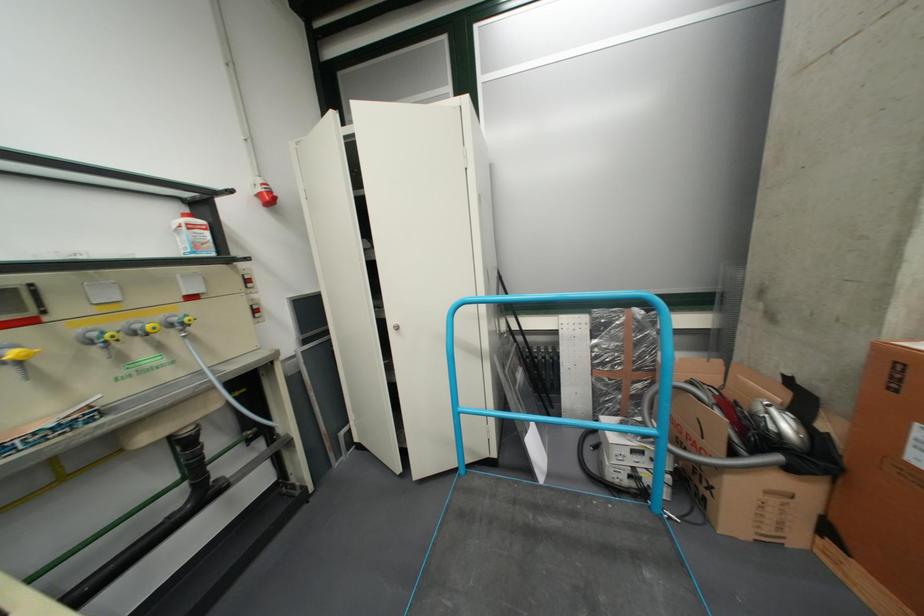
The image size is (924, 616). What do you see at coordinates (395, 326) in the screenshot? I see `a silver cabinet handle` at bounding box center [395, 326].